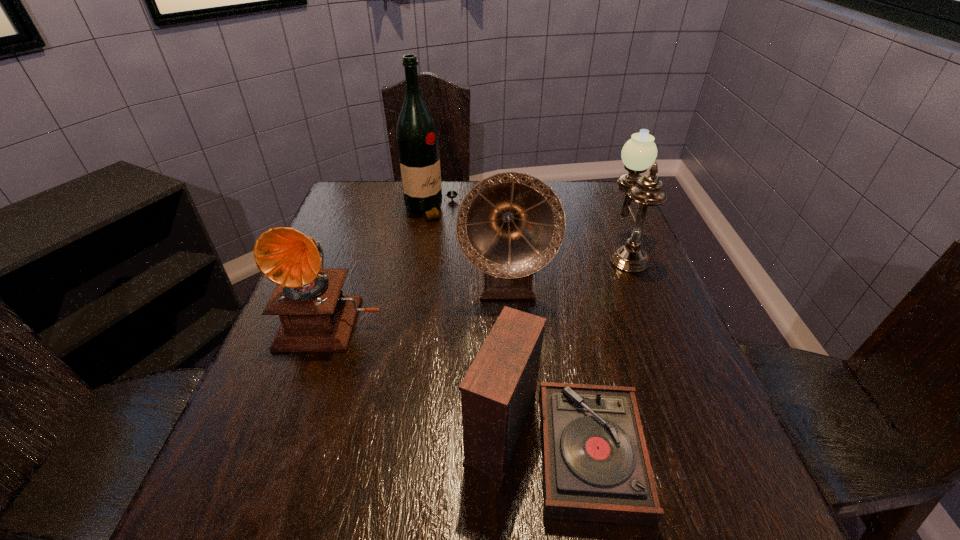
Find the location of `the tallest object`. the tallest object is located at coordinates (417, 140).

This screenshot has height=540, width=960. In order to click on the farthest object in this screenshot , I will do `click(417, 140)`.

In order to click on oil lamp in this screenshot , I will do (x=639, y=153).

Locate an element on the screen. Image resolution: width=960 pixels, height=540 pixels. the leftmost phonograph record is located at coordinates (315, 316).

Locate an element on the screen. Image resolution: width=960 pixels, height=540 pixels. the nearest object is located at coordinates (595, 463).

Where is `the shortest object`? The width and height of the screenshot is (960, 540). the shortest object is located at coordinates (595, 463).

Where is `vacant space located on the front of the farthest object`? This screenshot has width=960, height=540. vacant space located on the front of the farthest object is located at coordinates (423, 268).

At what (x,y) coordinates should I click in order to perform the action: click on free spot located 0.260m on the left of the rightmost object. Please return your answer as a coordinate pair (x, y). This screenshot has width=960, height=540. Looking at the image, I should click on coord(506,249).

The height and width of the screenshot is (540, 960). I want to click on free space located 0.130m on the horn of the leftmost phonograph record, so click(x=304, y=409).

This screenshot has width=960, height=540. What are the coordinates of `free space located on the back of the shortest object` in the screenshot? It's located at (537, 318).